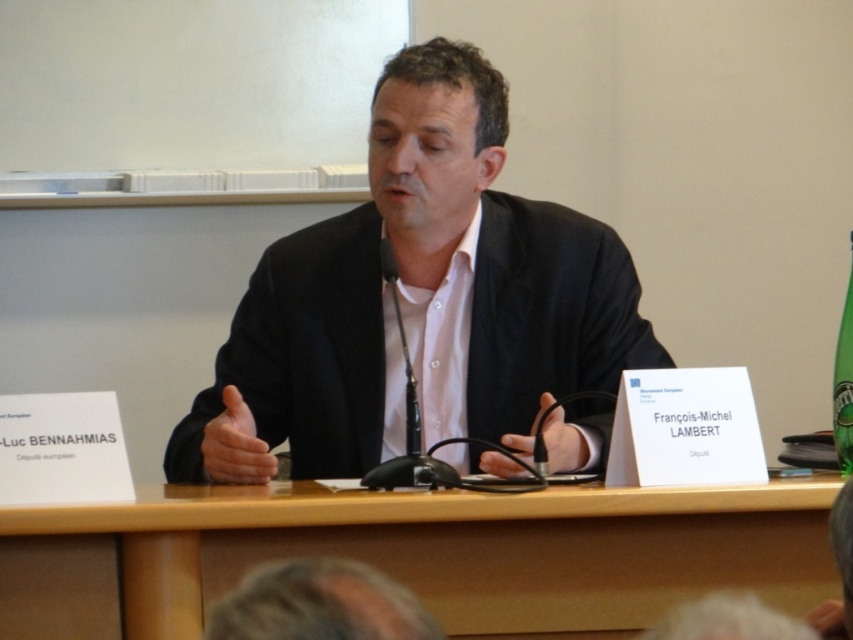
Question: Is wooden table at center behind gray hair at lower center?

Choices:
 (A) yes
 (B) no

Answer: (A)

Question: Is black matte suit at center bigger than wooden table at center?

Choices:
 (A) no
 (B) yes

Answer: (B)

Question: Based on their relative distances, which object is farther from the matte black hand at center?

Choices:
 (A) black matte suit at center
 (B) wooden table at center
 (C) gray hair at lower center

Answer: (C)

Question: Which object appears farthest from the camera in this image?

Choices:
 (A) wooden table at center
 (B) black matte microphone at center
 (C) matte black hand at center
 (D) gray hair at lower center

Answer: (B)

Question: Which point is closer to the camera taking this photo?

Choices:
 (A) (515, 241)
 (B) (573, 433)

Answer: (B)

Question: Does wooden table at center have a smaller size compared to matte black hand at center?

Choices:
 (A) yes
 (B) no

Answer: (B)